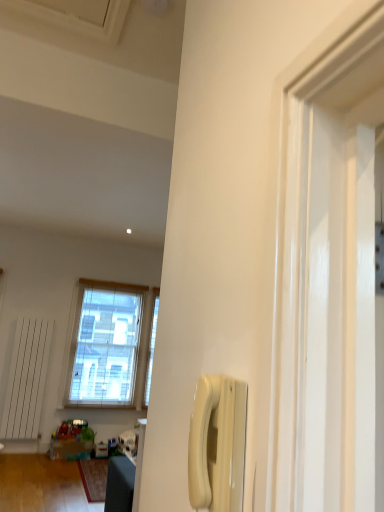
The width and height of the screenshot is (384, 512). I want to click on clear glass window at center, so click(107, 345).

The image size is (384, 512). What do you see at coordinates (107, 345) in the screenshot?
I see `clear glass window at center` at bounding box center [107, 345].

I want to click on translucent plastic toys at lower left, so click(71, 440).

Where is `white plastic phone at center-right`? The image size is (384, 512). white plastic phone at center-right is located at coordinates (218, 444).

The width and height of the screenshot is (384, 512). Find the location of `clear glass window at center`. clear glass window at center is located at coordinates (107, 345).

Is point (85, 436) positioned after point (66, 358)?

No, it is not.

Is translucent plastic toys at lower left at the left side of clear glass window at center?

Correct, you'll find translucent plastic toys at lower left to the left of clear glass window at center.

From the image's perspective, is translucent plastic toys at lower left beneath clear glass window at center?

Indeed, from the image's perspective, translucent plastic toys at lower left is shown beneath clear glass window at center.

Could you tell me if translucent plastic toys at lower left is turned towards clear glass window at center?

No, translucent plastic toys at lower left is not turned towards clear glass window at center.

How many degrees apart are the facing directions of white plastic phone at center-right and clear glass window at center?

white plastic phone at center-right and clear glass window at center are facing 90 degrees away from each other.

Consider the image. Can you confirm if white plastic phone at center-right is positioned to the right of clear glass window at center?

Yes.

Can you confirm if white plastic phone at center-right is shorter than clear glass window at center?

Yes, white plastic phone at center-right is shorter than clear glass window at center.

Does white plastic phone at center-right have a larger size compared to clear glass window at center?

Actually, white plastic phone at center-right might be smaller than clear glass window at center.

In terms of width, does white plastic phone at center-right look wider or thinner when compared to translucent plastic toys at lower left?

Considering their sizes, white plastic phone at center-right looks slimmer than translucent plastic toys at lower left.

From a real-world perspective, relative to translucent plastic toys at lower left, is white plastic phone at center-right vertically above or below?

white plastic phone at center-right is above translucent plastic toys at lower left.

Which of these two, white plastic phone at center-right or translucent plastic toys at lower left, is smaller?

With smaller size is white plastic phone at center-right.

Is there a large distance between white plastic phone at center-right and translucent plastic toys at lower left?

white plastic phone at center-right is positioned a significant distance from translucent plastic toys at lower left.

Is translucent plastic toys at lower left next to white plastic phone at center-right and touching it?

translucent plastic toys at lower left and white plastic phone at center-right are not in contact.

Where is `toy that is under the white plastic phone at center-right (from a real-world perspective)`? toy that is under the white plastic phone at center-right (from a real-world perspective) is located at coordinates (71, 440).

Is point (78, 457) farther from camera compared to point (226, 394)?

Yes.

In the scene shown: Do you think clear glass window at center is within translucent plastic toys at lower left, or outside of it?

clear glass window at center is not inside translucent plastic toys at lower left, it's outside.

Would you consider clear glass window at center to be distant from translucent plastic toys at lower left?

Indeed, clear glass window at center is not near translucent plastic toys at lower left.

Between clear glass window at center and translucent plastic toys at lower left, which one has smaller size?

translucent plastic toys at lower left is smaller.

Which object is further away from the camera taking this photo, clear glass window at center or translucent plastic toys at lower left?

clear glass window at center is further from the camera.

Visually, is clear glass window at center positioned to the left or to the right of white plastic phone at center-right?

Based on their positions, clear glass window at center is located to the left of white plastic phone at center-right.

Is clear glass window at center thinner than white plastic phone at center-right?

No, clear glass window at center is not thinner than white plastic phone at center-right.

From the image's perspective, is clear glass window at center over white plastic phone at center-right?

Incorrect, from the image's perspective, clear glass window at center is lower than white plastic phone at center-right.

The height and width of the screenshot is (512, 384). I want to click on toy in front of the clear glass window at center, so click(x=71, y=440).

Where is `window above the white plastic phone at center-right (from a real-world perspective)`? window above the white plastic phone at center-right (from a real-world perspective) is located at coordinates (107, 345).

From the picture: Estimate the real-world distances between objects in this image. Which object is closer to white plastic phone at center-right, translucent plastic toys at lower left or clear glass window at center?

The object closer to white plastic phone at center-right is translucent plastic toys at lower left.

Considering their positions, is clear glass window at center positioned further to translucent plastic toys at lower left than white plastic phone at center-right?

white plastic phone at center-right.

From the image, which object appears to be nearer to clear glass window at center, white plastic phone at center-right or translucent plastic toys at lower left?

Based on the image, translucent plastic toys at lower left appears to be nearer to clear glass window at center.

Looking at the image, which one is located further to translucent plastic toys at lower left, white plastic phone at center-right or clear glass window at center?

white plastic phone at center-right.

Looking at the image, which one is located closer to white plastic phone at center-right, clear glass window at center or translucent plastic toys at lower left?

Among the two, translucent plastic toys at lower left is located nearer to white plastic phone at center-right.

Considering their positions, is translucent plastic toys at lower left positioned closer to clear glass window at center than white plastic phone at center-right?

The object closer to clear glass window at center is translucent plastic toys at lower left.

Locate an element on the screen. This screenshot has height=512, width=384. toy positioned between white plastic phone at center-right and clear glass window at center from near to far is located at coordinates (71, 440).